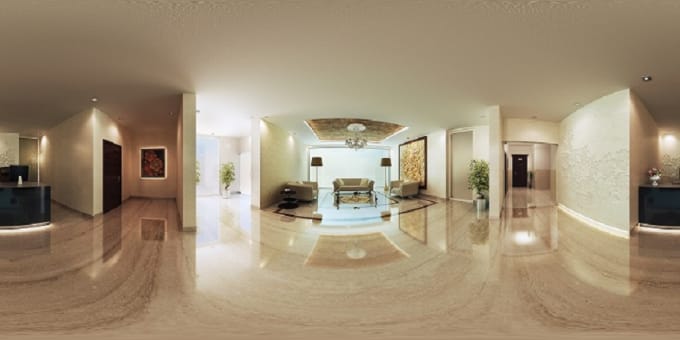
This screenshot has width=680, height=340. Find the location of `chandelier`. chandelier is located at coordinates (354, 140).